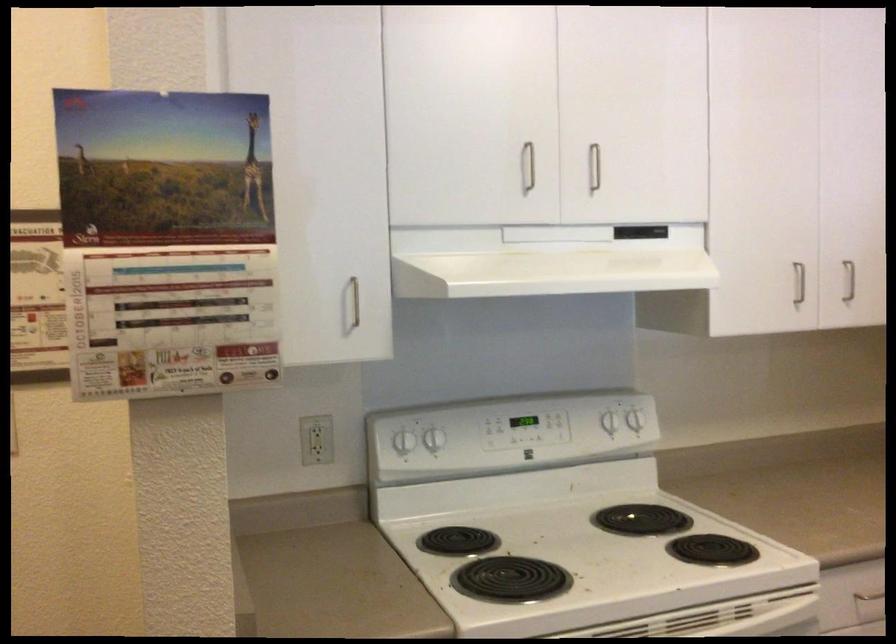
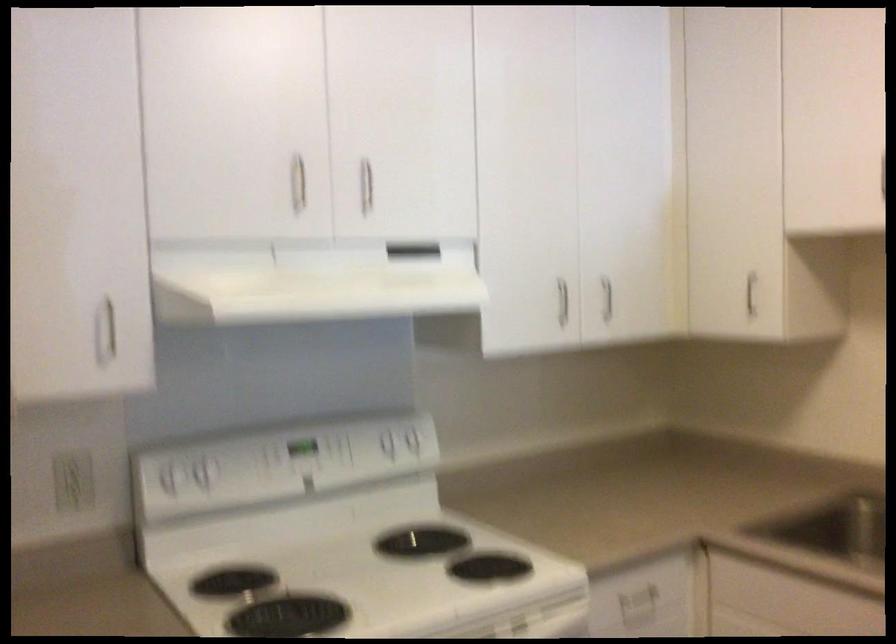
Question: The camera is either moving clockwise (left) or counter-clockwise (right) around the object. The first image is from the beginning of the video and the second image is from the end. Is the camera moving left or right when shooting the video?

Choices:
 (A) Left
 (B) Right

Answer: (A)